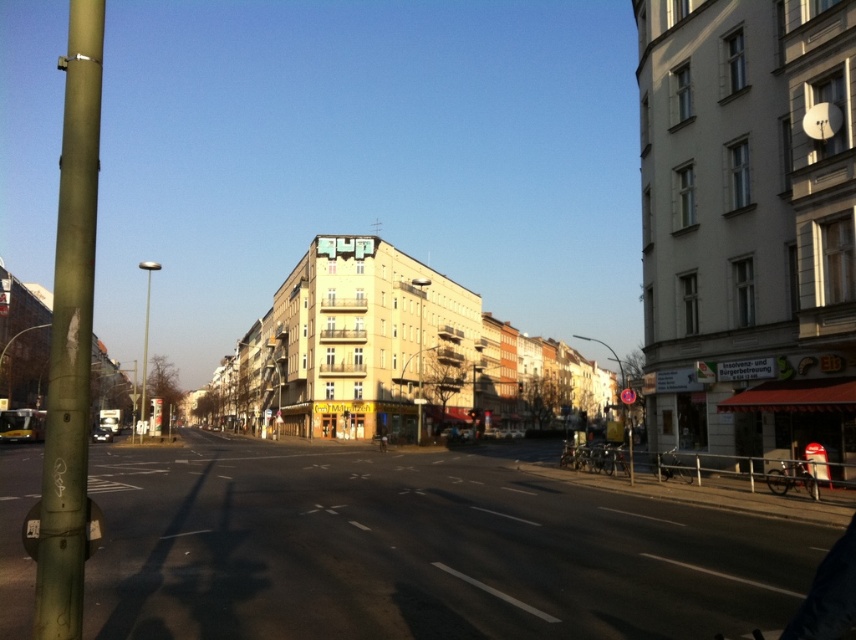
You are a delivery driver needing to park your vehicle between the green matte pole at left and the metallic reflective sign at center. The vehicle is 15 feet long. Is there enough space between them to park?

The distance between the green matte pole at left and the metallic reflective sign at center is 231.21 feet, so yes, the vehicle can park between them as there is sufficient space.

You are a city planner assessing the street layout. You need to install a new traffic light that must be shorter than the existing green matte pole at left. Can the metallic reflective sign at center be used as a reference for the maximum height of the new traffic light?

The green matte pole at left is taller than the metallic reflective sign at center. Therefore, the metallic reflective sign at center can serve as a reference for the maximum height since it is shorter than the existing pole.